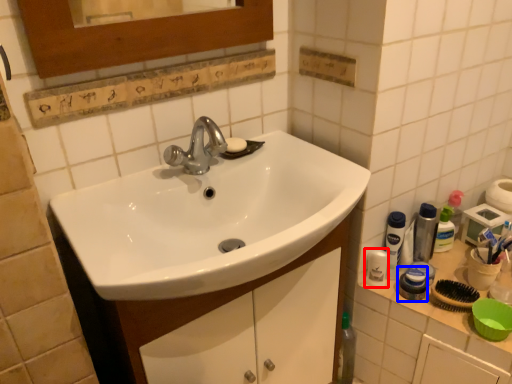
Question: Which object is further to the camera taking this photo, mouthwash (highlighted by a red box) or mouthwash (highlighted by a blue box)?

Choices:
 (A) mouthwash
 (B) mouthwash

Answer: (A)